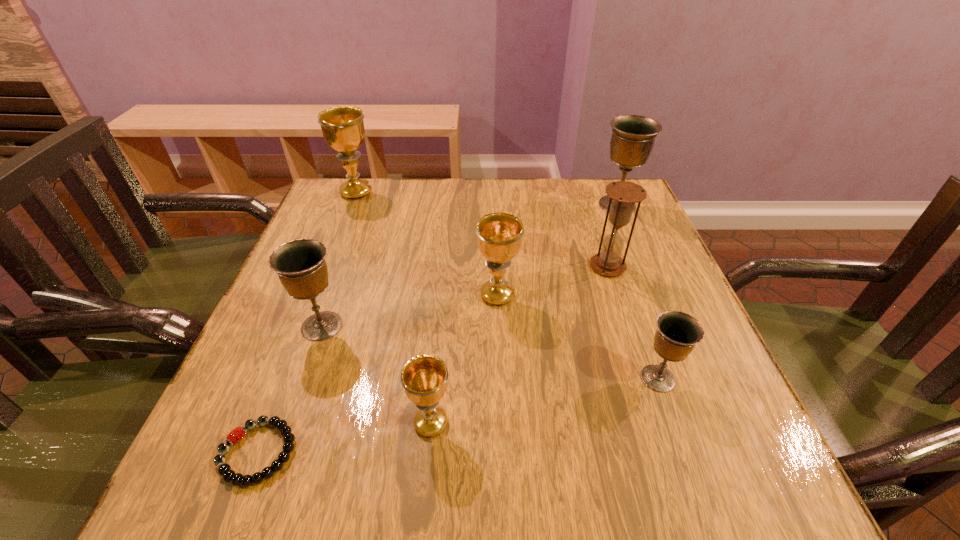
At what (x,y) coordinates should I click in order to perform the action: click on free region located 0.120m on the left of the fourth chalice from right to left. Please return your answer as a coordinate pair (x, y). The width and height of the screenshot is (960, 540). Looking at the image, I should click on (336, 423).

Identify the location of free space located 0.340m on the back of the nearest bronze chalice. This screenshot has height=540, width=960. (612, 247).

The width and height of the screenshot is (960, 540). I want to click on free spot located on the back of the bracelet, so click(x=284, y=383).

You are a GUI agent. You are given a task and a screenshot of the screen. Output one action in this format:
    pyautogui.click(x=<x>, y=<y>)
    Task: Click on the chalice at the near edge
    This screenshot has width=960, height=540.
    Given the screenshot: What is the action you would take?
    pyautogui.click(x=424, y=378)

At what (x,y) coordinates should I click in order to perform the action: click on bracelet that is at the near edge. Please return your answer as a coordinate pair (x, y). Looking at the image, I should click on (224, 469).

At what (x,y) coordinates should I click in order to perform the action: click on bracelet present at the left edge. Please return your answer as a coordinate pair (x, y). The width and height of the screenshot is (960, 540). Looking at the image, I should click on (224, 469).

Identify the location of hourglass present at the right edge. The height and width of the screenshot is (540, 960). (625, 194).

Find the location of a particular element. The height and width of the screenshot is (540, 960). object present at the far left corner is located at coordinates (343, 129).

Locate an element on the screen. object positioned at the near left corner is located at coordinates (224, 469).

The height and width of the screenshot is (540, 960). In order to click on object positioned at the far right corner in this screenshot , I will do `click(632, 141)`.